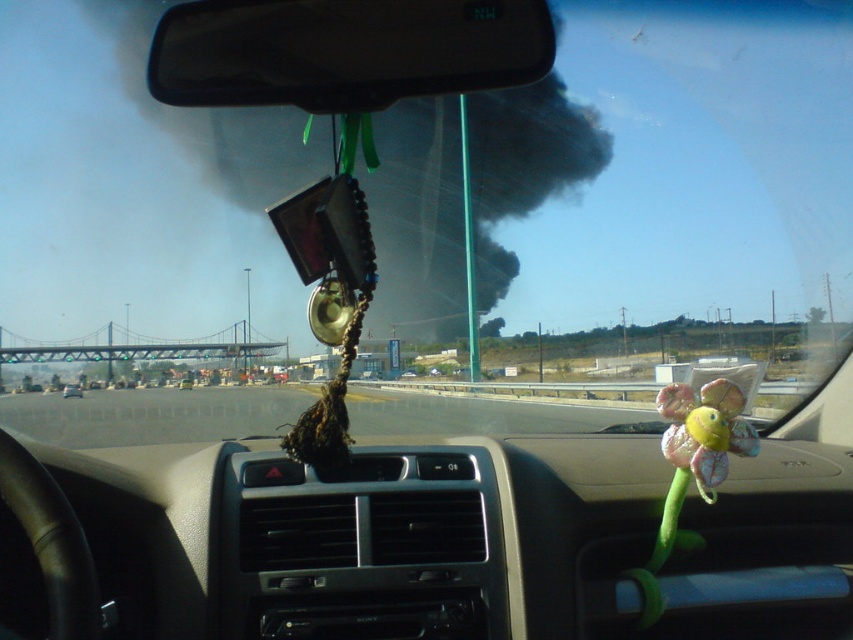
You are driving a car and want to know if your metallic silver car at center will fit on the smooth asphalt highway at center. Can you determine this based on their sizes?

The smooth asphalt highway at center has a larger size compared to metallic silver car at center, so yes, the metallic silver car at center will fit on the smooth asphalt highway at center since the highway is larger in size.

You are driving a car and notice two objects in your line of sight through the windshield. Which object is closer to you between the multicolored fabric flower at center and the metallic silver car at center?

The multicolored fabric flower at center is closer to you because it is in front of the metallic silver car at center.